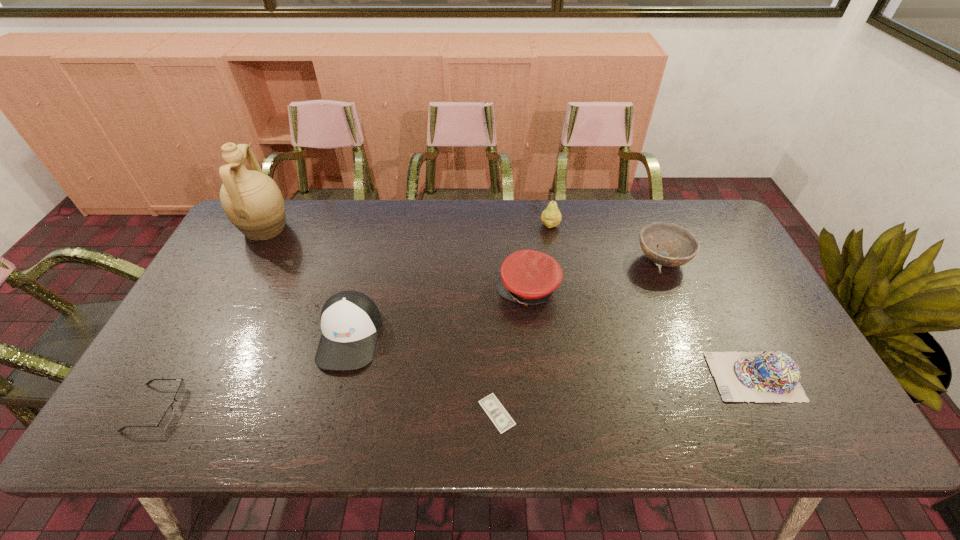
Where is `cap that is the second closest to the shortest object`? cap that is the second closest to the shortest object is located at coordinates (350, 321).

Where is `free spot that satisfies the following two spatial constraints: 1. on the front of the second cap from left to right with an emblem; 2. on the front panel of the leftmost cap`? The height and width of the screenshot is (540, 960). free spot that satisfies the following two spatial constraints: 1. on the front of the second cap from left to right with an emblem; 2. on the front panel of the leftmost cap is located at coordinates (532, 336).

Where is `free spot that satisfies the following two spatial constraints: 1. on the front, side, and top of the rightmost cap; 2. on the front side of the shortest object`? free spot that satisfies the following two spatial constraints: 1. on the front, side, and top of the rightmost cap; 2. on the front side of the shortest object is located at coordinates (772, 413).